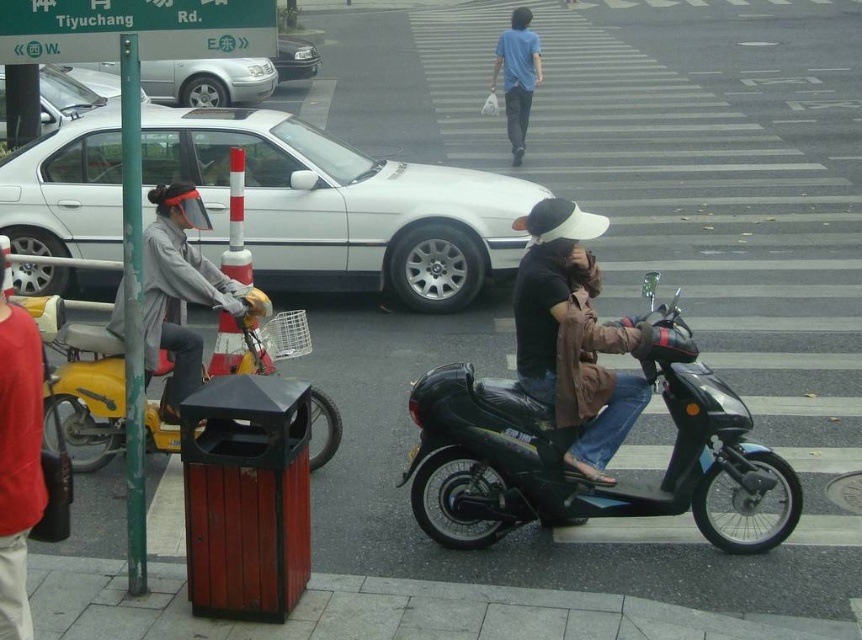
You are standing at the point with coordinates [91,392] in the image. What object is located exactly at this point?

The yellow matte motorcycle is located exactly at point [91,392].

You are a delivery driver needing to pass through the area between the white matte sedan at center and the black matte motorcycle at center. Which direction should you steer your vehicle to avoid collision?

You should steer to the right side because the white matte sedan at center is positioned to the left of the black matte motorcycle at center, so moving right would allow you to bypass the vehicles safely.

Based on the photo, you are a pedestrian trying to cross the street and see the yellow matte motorcycle at left and the gray fabric jacket at left. Which object is positioned further to the left?

The yellow matte motorcycle at left is positioned to the left of the gray fabric jacket at left, so it is further to the left.